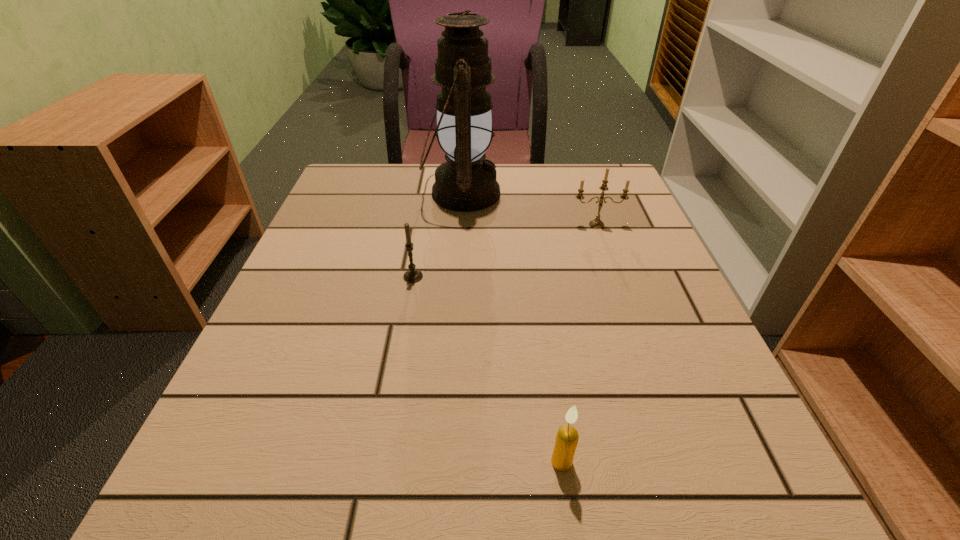
Image resolution: width=960 pixels, height=540 pixels. Find the location of `oil lamp`. oil lamp is located at coordinates (466, 182).

The width and height of the screenshot is (960, 540). I want to click on the rightmost candle, so click(596, 223).

Identify the location of the farthest candle. (596, 223).

Identify the location of the second candle from left to right. (567, 436).

Where is `the third object from left to right`? Image resolution: width=960 pixels, height=540 pixels. the third object from left to right is located at coordinates (567, 436).

Identify the location of the third farthest object. click(x=412, y=275).

Where is `the leftmost candle`? The height and width of the screenshot is (540, 960). the leftmost candle is located at coordinates (412, 275).

Locate an element on the screen. blank space located 0.340m on the front of the oil lamp is located at coordinates pos(453,338).

Where is `vacant area located on the front of the farthest candle`? vacant area located on the front of the farthest candle is located at coordinates (618, 287).

At what (x,y) coordinates should I click in order to perform the action: click on vacant space located 0.250m on the back of the second object from right to left. Please return your answer as a coordinate pair (x, y). This screenshot has width=960, height=540. Looking at the image, I should click on (540, 316).